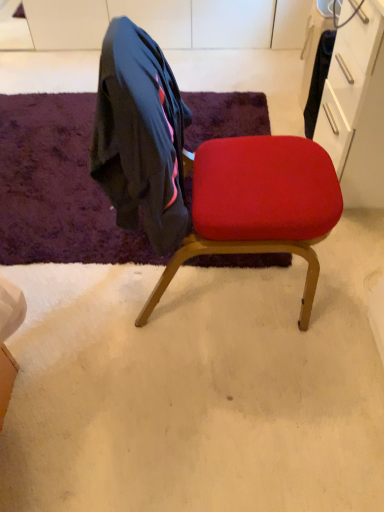
Question: Is purple shaggy rug at upper left wider or thinner than velvet red chair at center?

Choices:
 (A) wide
 (B) thin

Answer: (A)

Question: In the image, is purple shaggy rug at upper left on the left side or the right side of velvet red chair at center?

Choices:
 (A) left
 (B) right

Answer: (A)

Question: Looking at the image, does purple shaggy rug at upper left seem bigger or smaller compared to velvet red chair at center?

Choices:
 (A) big
 (B) small

Answer: (B)

Question: Considering the positions of velvet red chair at center and purple shaggy rug at upper left in the image, is velvet red chair at center bigger or smaller than purple shaggy rug at upper left?

Choices:
 (A) small
 (B) big

Answer: (B)

Question: Is point (286, 209) positioned closer to the camera than point (236, 128)?

Choices:
 (A) farther
 (B) closer

Answer: (B)

Question: From a real-world perspective, is velvet red chair at center above or below purple shaggy rug at upper left?

Choices:
 (A) above
 (B) below

Answer: (A)

Question: Do you think velvet red chair at center is within purple shaggy rug at upper left, or outside of it?

Choices:
 (A) outside
 (B) inside

Answer: (A)